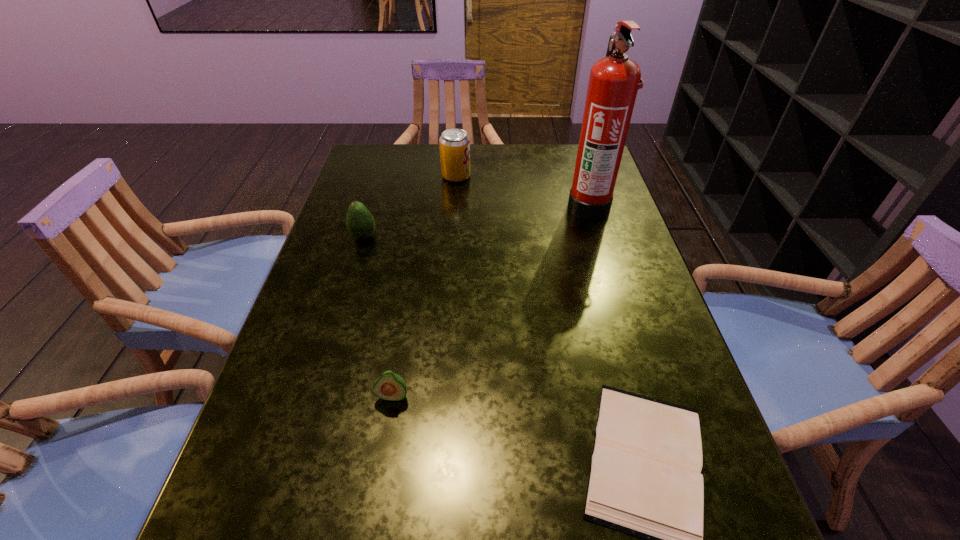
At what (x,y) coordinates should I click in order to perform the action: click on free region located with the nozzle pointing from the back of the tallest object. Please return your answer as a coordinate pair (x, y). This screenshot has height=540, width=960. Looking at the image, I should click on (437, 206).

Locate an element on the screen. The width and height of the screenshot is (960, 540). vacant area situated on the back of the pop (soda) is located at coordinates (458, 154).

Image resolution: width=960 pixels, height=540 pixels. I want to click on vacant space located 0.210m on the front of the leftmost object, so pyautogui.click(x=342, y=308).

At what (x,y) coordinates should I click in order to perform the action: click on free space located 0.070m on the cut side of the second object from left to right. Please return your answer as a coordinate pair (x, y). Image resolution: width=960 pixels, height=540 pixels. Looking at the image, I should click on (385, 443).

Identify the location of object that is at the far edge. click(x=454, y=144).

This screenshot has width=960, height=540. What are the coordinates of `object at the left edge` in the screenshot? It's located at (360, 223).

I want to click on object located at the right edge, so click(614, 80).

In the image, there is a desktop. At what (x,y) coordinates should I click in order to perform the action: click on vacant space at the far edge. Please return your answer as a coordinate pair (x, y). Looking at the image, I should click on (535, 183).

In the image, there is a desktop. In order to click on vacant space at the left edge in this screenshot , I will do `click(287, 421)`.

The height and width of the screenshot is (540, 960). Identify the location of free spot at the right edge of the desktop. (569, 193).